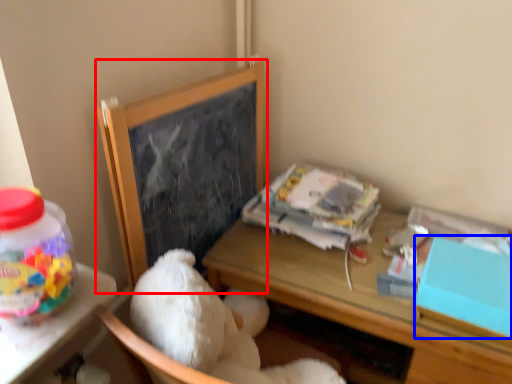
Question: Which object is closer to the camera taking this photo, bulletin board (highlighted by a red box) or box (highlighted by a blue box)?

Choices:
 (A) bulletin board
 (B) box

Answer: (B)